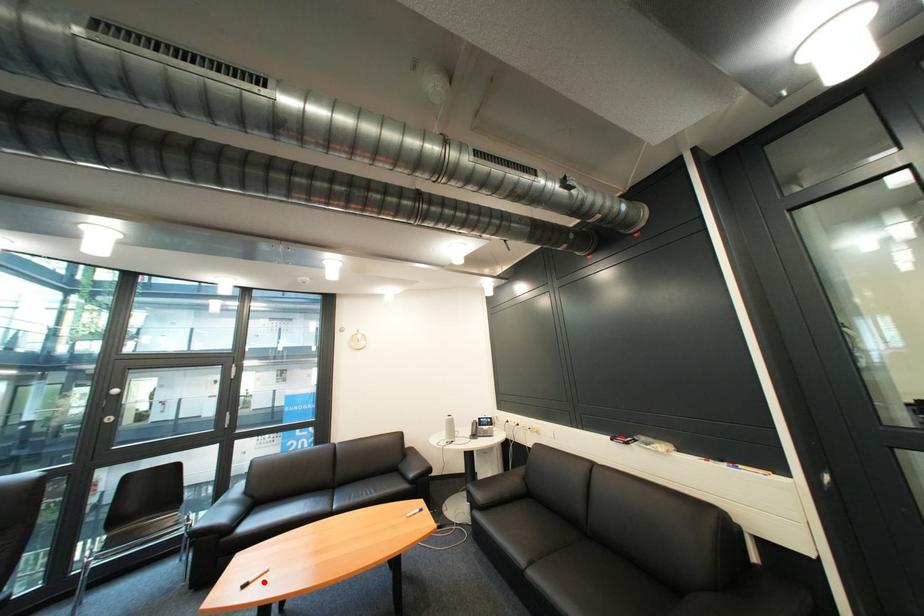
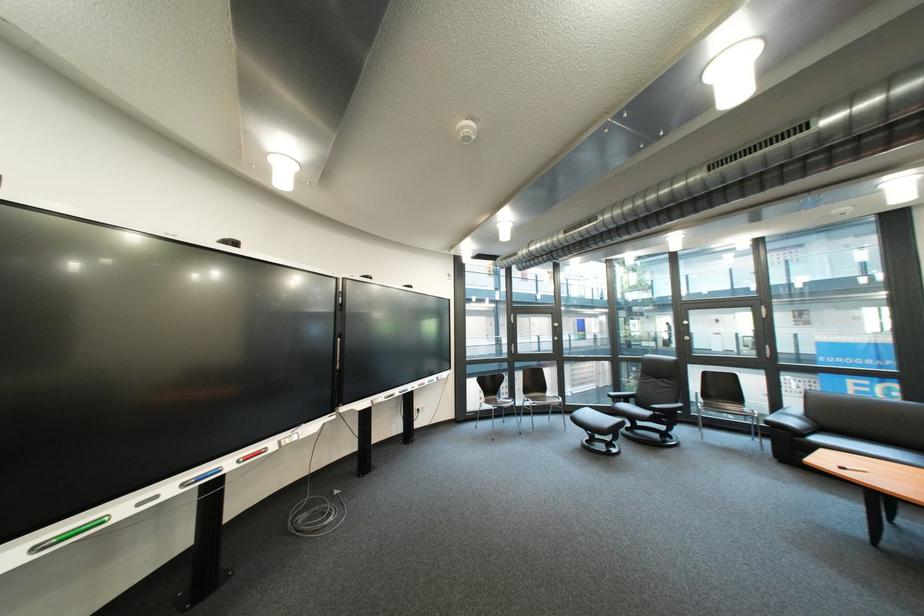
Find the pixel in the second image that matches the highlighted location in the first image.

(862, 469)